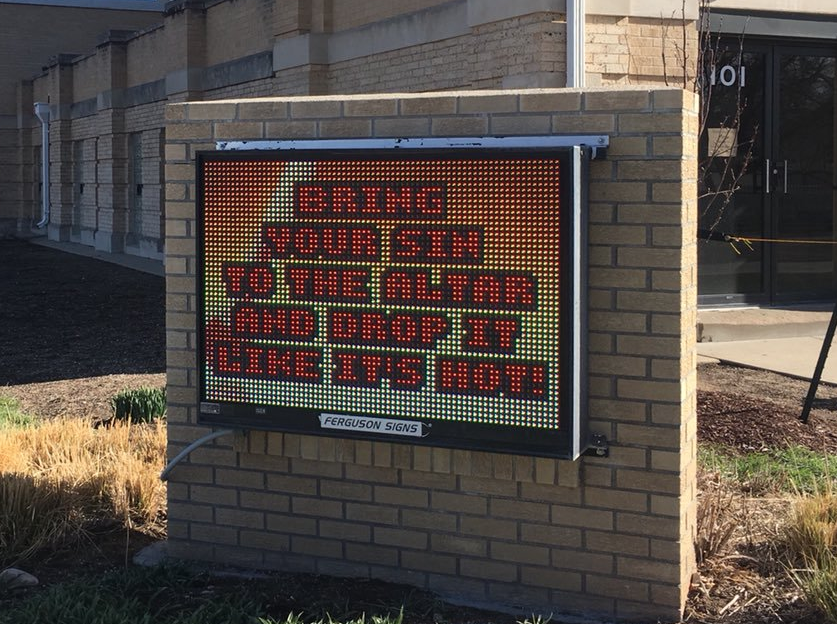
The width and height of the screenshot is (837, 624). I want to click on door handle, so click(x=768, y=180).